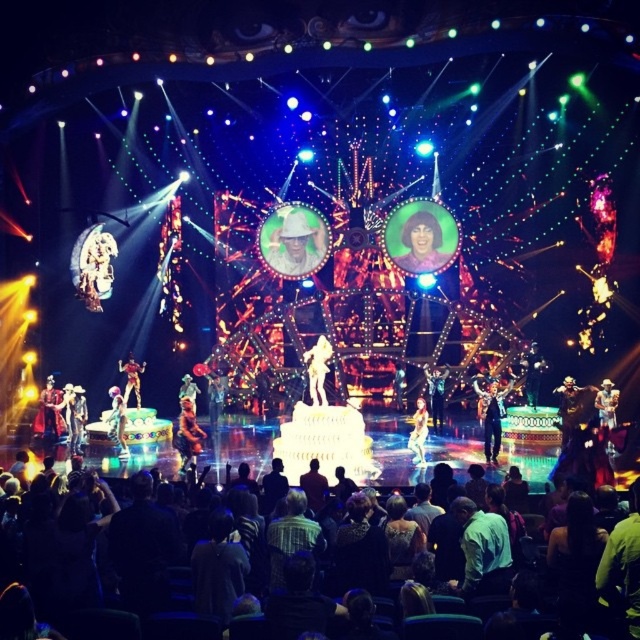
Question: Does shiny silver dress at center appear under shiny gold figure at center?

Choices:
 (A) no
 (B) yes

Answer: (B)

Question: Is shiny gold costume at center further to camera compared to shiny gold helmet at right?

Choices:
 (A) yes
 (B) no

Answer: (B)

Question: Which point is closer to the camera taking this photo?

Choices:
 (A) (435, 381)
 (B) (403, 376)
 (C) (124, 419)

Answer: (C)

Question: Which is farther from the dark fabric seats at lower center?

Choices:
 (A) shiny gold suit at center
 (B) pastel pink fabric at center
 (C) metallic gold statue at center
 (D) shiny silver dress at center

Answer: (B)

Question: Based on their relative distances, which object is nearer to the shiny black suit at center?

Choices:
 (A) shiny gold helmet at right
 (B) white glossy statue at center

Answer: (A)

Question: Where is matte white hat at center located in relation to shiny gold helmet at right in the image?

Choices:
 (A) below
 (B) above

Answer: (B)